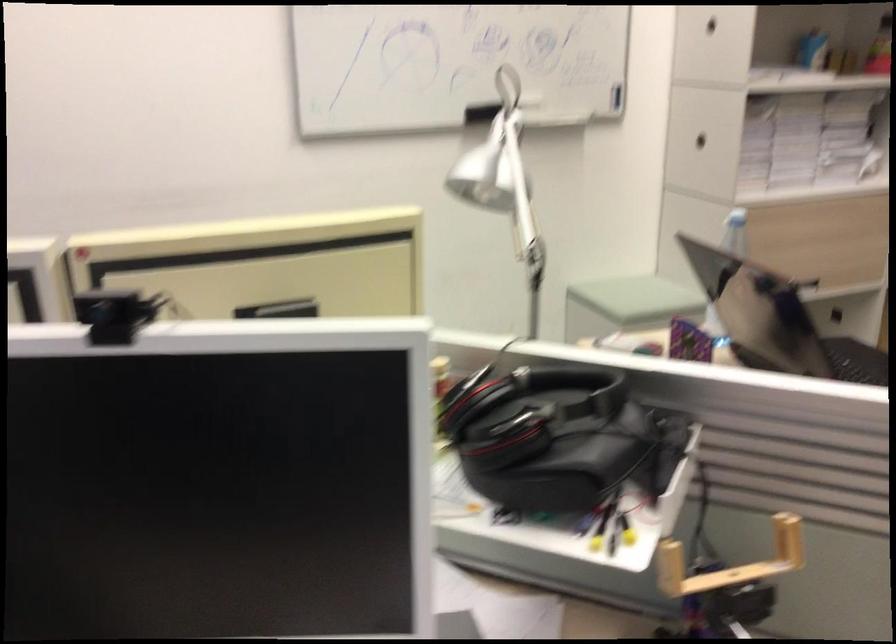
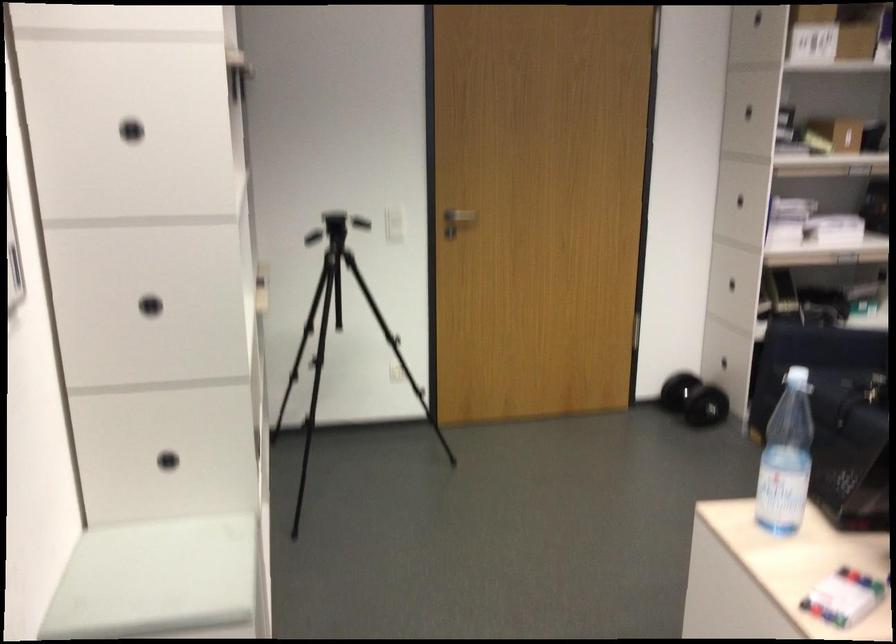
Where in the second image is the point corresponding to point 661,305 from the first image?

(159, 581)